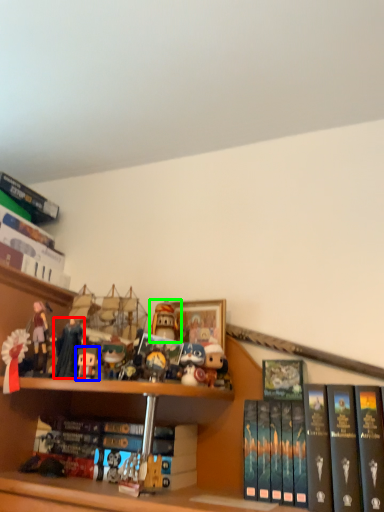
Question: Estimate the real-world distances between objects in this image. Which object is farther from toy (highlighted by a red box), toy (highlighted by a blue box) or toy (highlighted by a green box)?

Choices:
 (A) toy
 (B) toy

Answer: (B)